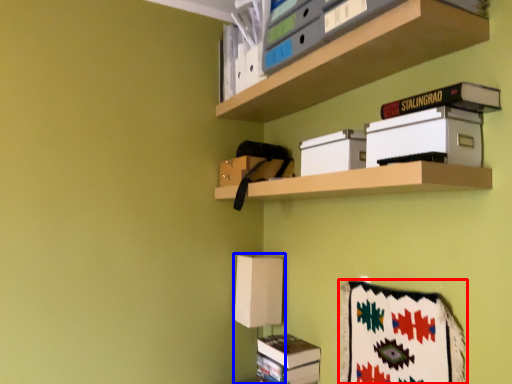
Question: Which object is further to the camera taking this photo, blanket (highlighted by a red box) or table lamp (highlighted by a blue box)?

Choices:
 (A) blanket
 (B) table lamp

Answer: (B)